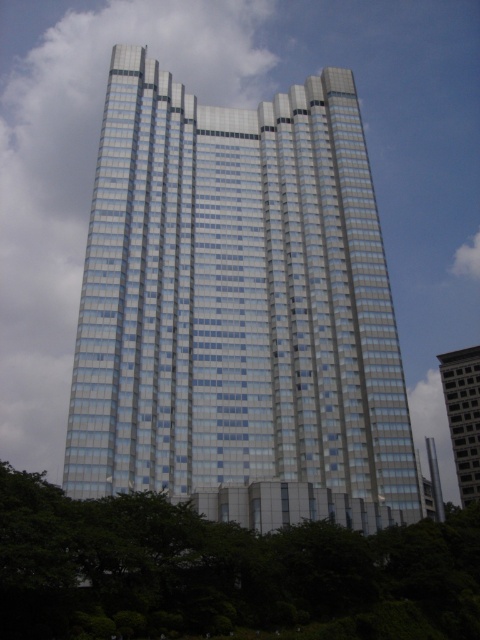
Question: Estimate the real-world distances between objects in this image. Which object is closer to the glassy reflective building at right?

Choices:
 (A) green leafy tree at lower center
 (B) glassy steel tower at center

Answer: (B)

Question: Is glassy steel tower at center behind green leafy tree at lower center?

Choices:
 (A) yes
 (B) no

Answer: (A)

Question: Which point is farther to the camera?

Choices:
 (A) glassy reflective building at right
 (B) green leafy tree at lower center
 (C) glassy steel tower at center

Answer: (A)

Question: Estimate the real-world distances between objects in this image. Which object is farther from the glassy steel tower at center?

Choices:
 (A) glassy reflective building at right
 (B) green leafy tree at lower center

Answer: (A)

Question: Does glassy steel tower at center appear under glassy reflective building at right?

Choices:
 (A) no
 (B) yes

Answer: (A)

Question: Can you confirm if green leafy tree at lower center is positioned to the right of glassy reflective building at right?

Choices:
 (A) no
 (B) yes

Answer: (A)